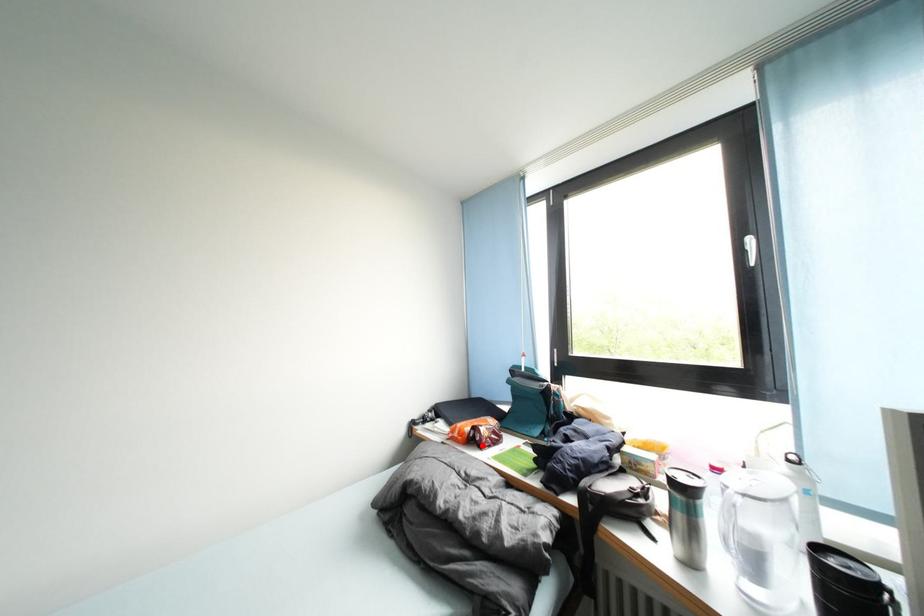
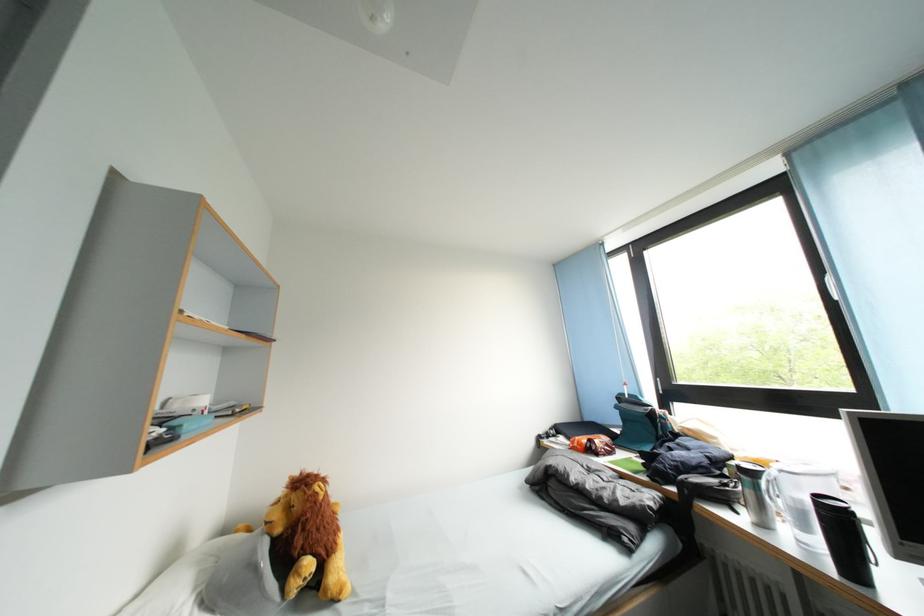
Where in the second image is the point corresponding to the highlighted location from the first image?

(600, 455)